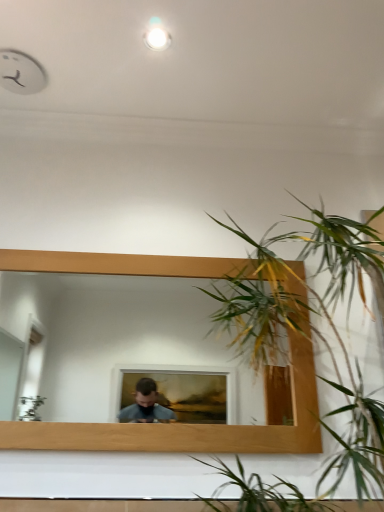
Question: Does white glossy light at upper center have a greater height compared to wooden mirror at center?

Choices:
 (A) yes
 (B) no

Answer: (B)

Question: Can you confirm if white glossy light at upper center is bigger than wooden mirror at center?

Choices:
 (A) yes
 (B) no

Answer: (B)

Question: Considering the relative sizes of white glossy light at upper center and wooden mirror at center in the image provided, is white glossy light at upper center shorter than wooden mirror at center?

Choices:
 (A) yes
 (B) no

Answer: (A)

Question: Is white glossy light at upper center far away from wooden mirror at center?

Choices:
 (A) no
 (B) yes

Answer: (B)

Question: Is white glossy light at upper center positioned with its back to wooden mirror at center?

Choices:
 (A) no
 (B) yes

Answer: (A)

Question: Is white glossy light at upper center at the left side of wooden mirror at center?

Choices:
 (A) no
 (B) yes

Answer: (A)

Question: Can you confirm if white glossy light at upper center is thinner than green leafy plant at right?

Choices:
 (A) yes
 (B) no

Answer: (A)

Question: Can you confirm if white glossy light at upper center is bigger than green leafy plant at right?

Choices:
 (A) yes
 (B) no

Answer: (B)

Question: Does white glossy light at upper center appear on the left side of green leafy plant at right?

Choices:
 (A) no
 (B) yes

Answer: (B)

Question: Can you confirm if white glossy light at upper center is wider than green leafy plant at right?

Choices:
 (A) yes
 (B) no

Answer: (B)

Question: Considering the relative positions of white glossy light at upper center and green leafy plant at right in the image provided, is white glossy light at upper center in front of green leafy plant at right?

Choices:
 (A) no
 (B) yes

Answer: (A)

Question: Is the position of white glossy light at upper center more distant than that of green leafy plant at right?

Choices:
 (A) yes
 (B) no

Answer: (A)

Question: Considering the relative sizes of wooden mirror at center and green leafy plant at right in the image provided, is wooden mirror at center thinner than green leafy plant at right?

Choices:
 (A) yes
 (B) no

Answer: (A)